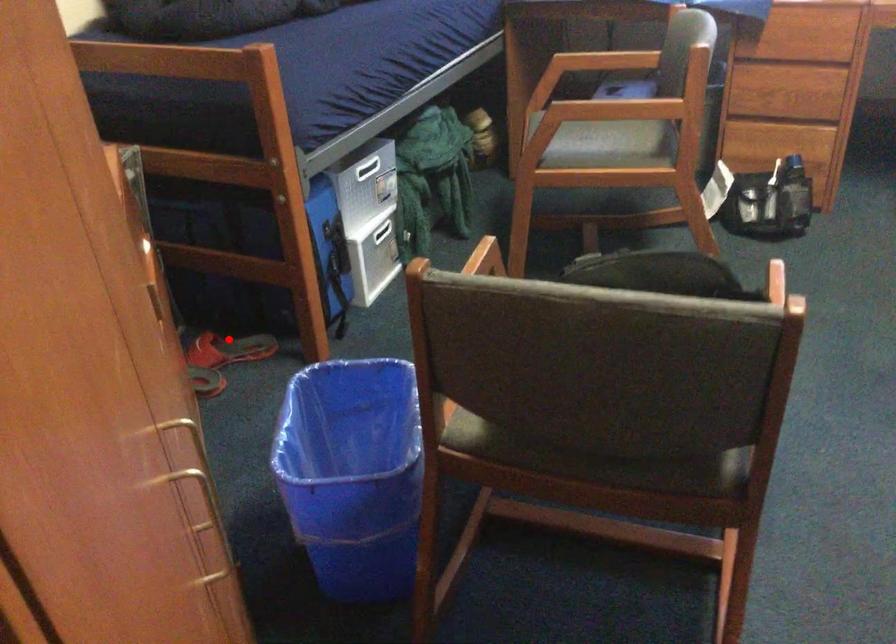
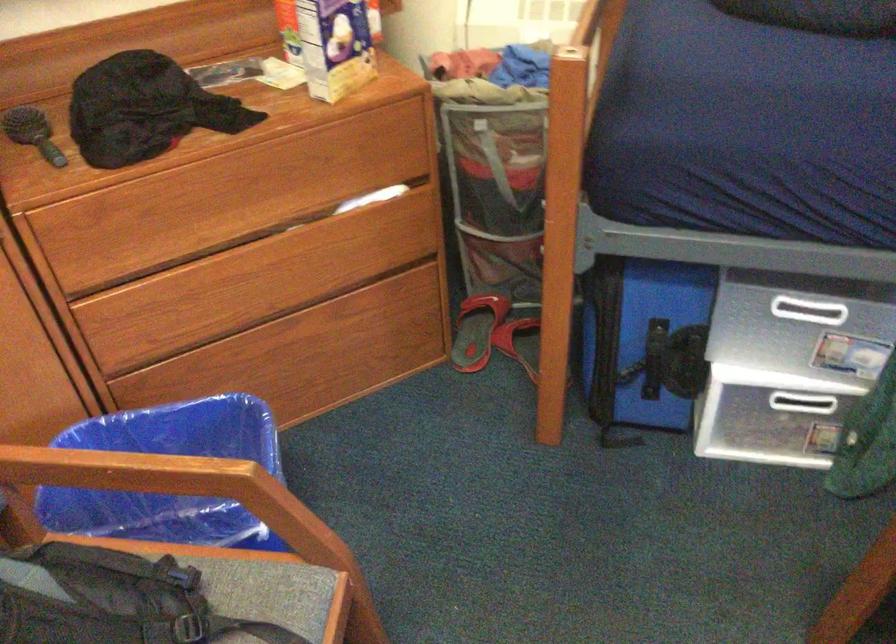
Question: I am providing you with two images of the same scene from different viewpoints. A red point is marked on the first image. Is the red point's position out of view in image 2?

Choices:
 (A) Yes
 (B) No

Answer: (A)